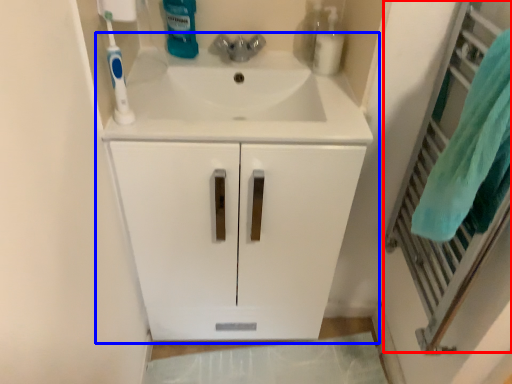
Question: Which of the following is the farthest to the observer, screen door (highlighted by a red box) or bathroom cabinet (highlighted by a blue box)?

Choices:
 (A) screen door
 (B) bathroom cabinet

Answer: (B)